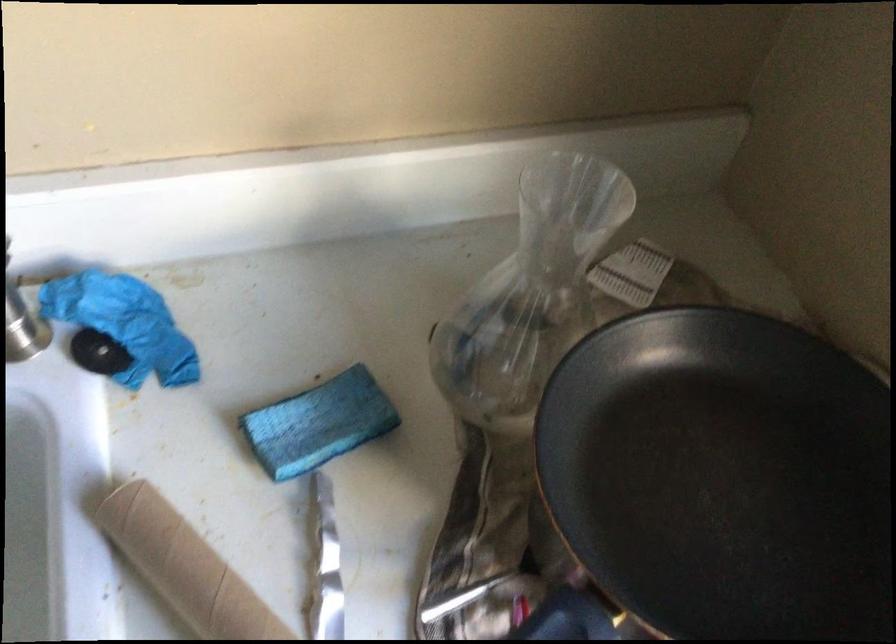
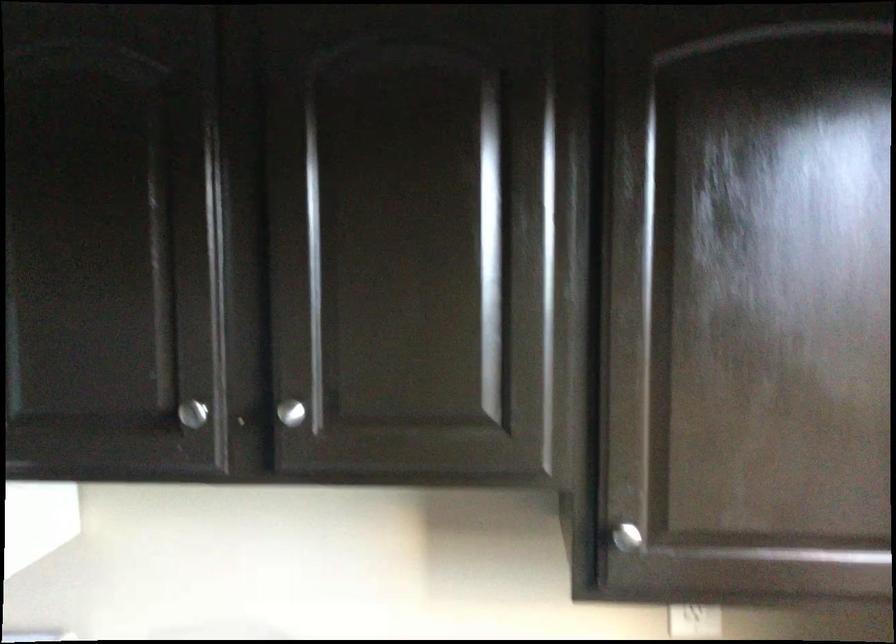
From the picture: The images are taken continuously from a first-person perspective. In which direction is your viewpoint rotating?

The camera's rotation is toward left-up.